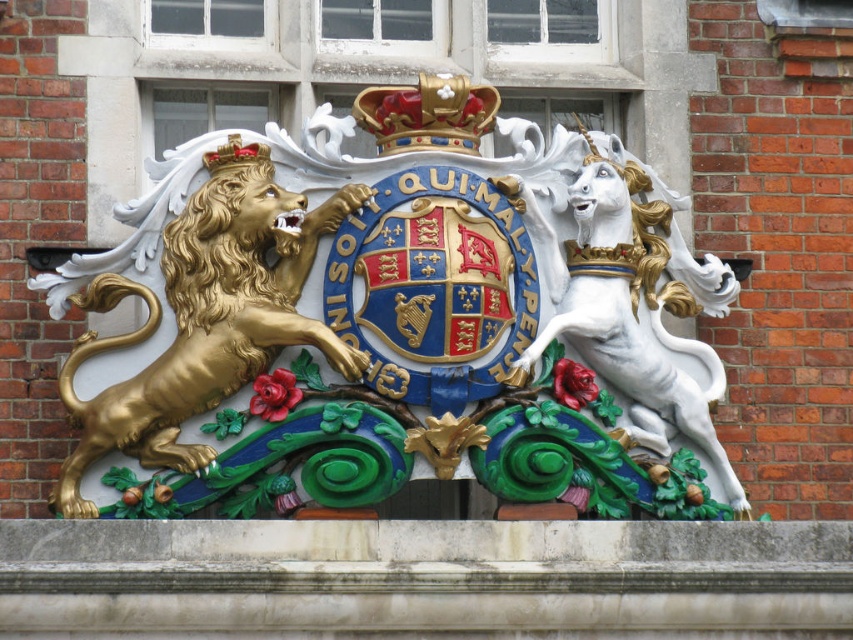
You are an art conservator examining the coat of arms. You need to determine if a protective cover designed for the gold jeweled crown at center can also fit over the gold polished lion at left. Based on their sizes, will the cover fit?

The gold polished lion at left has a lesser width compared to the gold jeweled crown at center. Therefore, the protective cover designed for the gold jeweled crown at center may be too large to properly fit over the gold polished lion at left, as the lion is narrower in width.

You are standing in front of a historical building and see the coat of arms with the gold metallic lion at center and the gold polished lion at left. If you want to touch both lions, which one would you need to take more steps towards? Please explain your reasoning based on their positions.

The gold metallic lion at center is 28.57 feet away from the gold polished lion at left. Since the gold polished lion at left is closer to you than the gold metallic lion at center, you would need to take more steps towards the gold metallic lion at center to reach it.

You are an architect examining the coat of arms on the brick wall. You notice a specific point marked at coordinates [641,308]. Which object on the coat of arms does this point correspond to?

The point at coordinates [641,308] corresponds to the white glossy unicorn at right.